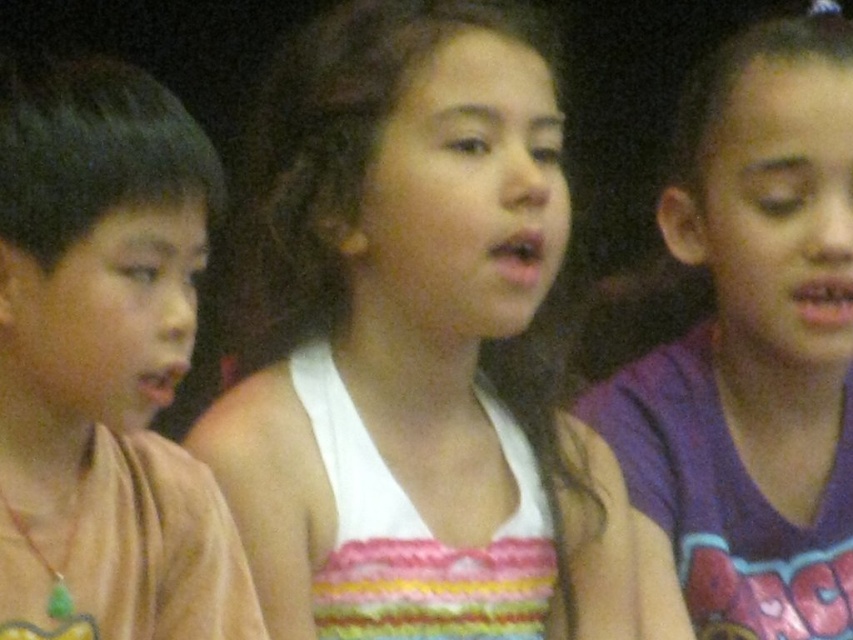
Does point (599, 586) come closer to viewer compared to point (733, 132)?

Yes, point (599, 586) is closer to viewer.

Which of these two, white knitted tank top at center or purple cotton shirt at right, stands shorter?

white knitted tank top at center is shorter.

The image size is (853, 640). I want to click on white knitted tank top at center, so click(413, 342).

Between point (657, 202) and point (132, 401), which one is positioned behind?

The point (657, 202) is behind.

Which is in front, point (825, 332) or point (77, 609)?

Point (77, 609) is in front.

Is point (720, 141) closer to camera compared to point (148, 305)?

That is False.

Locate an element on the screen. The image size is (853, 640). purple cotton shirt at right is located at coordinates (746, 349).

Where is `white knitted tank top at center`? The image size is (853, 640). white knitted tank top at center is located at coordinates (413, 342).

Who is more distant from viewer, (473,84) or (216,205)?

Point (473,84)

Between point (201, 454) and point (184, 356), which one is positioned in front?

Positioned in front is point (184, 356).

This screenshot has height=640, width=853. Identify the location of white knitted tank top at center. (413, 342).